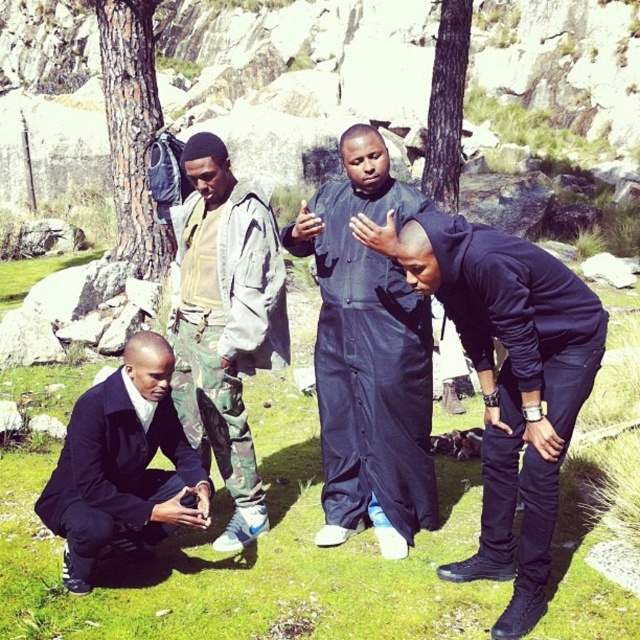
Which of these two, black matte jumpsuit at center or camouflage fabric pants at lower left, stands taller?

black matte jumpsuit at center is taller.

Who is more forward, (344, 294) or (180, 317)?

Point (344, 294) is more forward.

Does point (372, 451) lie in front of point (268, 268)?

No, it is behind (268, 268).

At what (x,y) coordinates should I click in order to perform the action: click on black matte jumpsuit at center. Please return your answer as a coordinate pair (x, y). The height and width of the screenshot is (640, 640). Looking at the image, I should click on (369, 353).

Is camouflage fabric pants at lower left further to camera compared to matte black suit at lower left?

Yes, it is behind matte black suit at lower left.

Does point (252, 512) come in front of point (97, 500)?

No, (252, 512) is further to viewer.

You are a GUI agent. You are given a task and a screenshot of the screen. Output one action in this format:
    pyautogui.click(x=<x>, y=<y>)
    Task: Click on the camouflage fabric pants at lower left
    
    Given the screenshot: What is the action you would take?
    pyautogui.click(x=225, y=323)

Does black matte hoodie at center appear on the left side of camouflage fabric pants at lower left?

No, black matte hoodie at center is not to the left of camouflage fabric pants at lower left.

Between point (481, 321) and point (253, 476), which one is positioned behind?

The point (253, 476) is behind.

Locate an element on the screen. The image size is (640, 640). black matte hoodie at center is located at coordinates (512, 385).